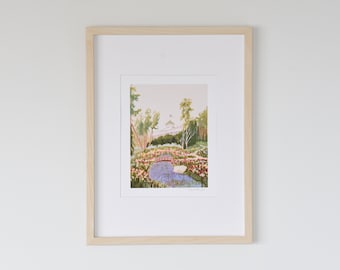
At what (x,y) coordinates should I click in order to perform the action: click on top right corner of painting. Please return your answer as a coordinate pair (x, y). Looking at the image, I should click on (206, 85).